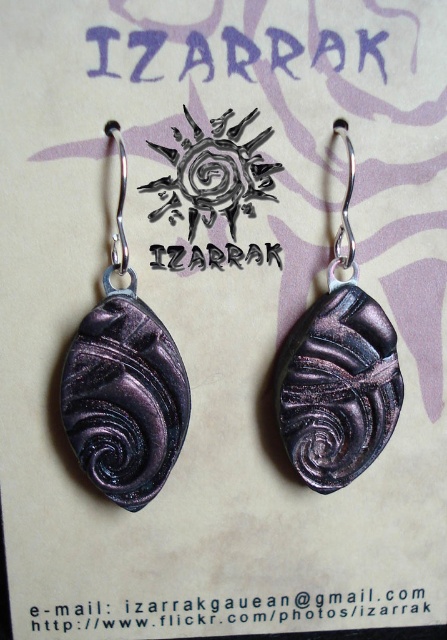
Can you confirm if metallic purple swirls at center is bigger than purple metallic swirl at center?

Yes, metallic purple swirls at center is bigger than purple metallic swirl at center.

Can you confirm if metallic purple swirls at center is positioned to the left of purple metallic swirl at center?

In fact, metallic purple swirls at center is to the right of purple metallic swirl at center.

Who is more distant from viewer, (346,349) or (230,227)?

The point (346,349) is behind.

Find the location of a particular element. The height and width of the screenshot is (640, 447). metallic purple swirls at center is located at coordinates (337, 372).

Which of these two, purple metallic swirls at left or purple metallic swirl at center, stands shorter?

purple metallic swirl at center

Measure the distance between point (x=110, y=266) and camera.

A distance of 4.07 feet exists between point (x=110, y=266) and camera.

Describe the element at coordinates (123, 385) in the screenshot. I see `purple metallic swirls at left` at that location.

This screenshot has height=640, width=447. What are the coordinates of `purple metallic swirls at left` in the screenshot? It's located at (123, 385).

Is purple metallic swirls at left to the left of metallic purple swirls at center from the viewer's perspective?

Correct, you'll find purple metallic swirls at left to the left of metallic purple swirls at center.

Based on the photo, does purple metallic swirls at left appear under metallic purple swirls at center?

Indeed, purple metallic swirls at left is positioned under metallic purple swirls at center.

At what (x,y) coordinates should I click in order to perform the action: click on purple metallic swirls at left. Please return your answer as a coordinate pair (x, y). Image resolution: width=447 pixels, height=640 pixels. Looking at the image, I should click on (123, 385).